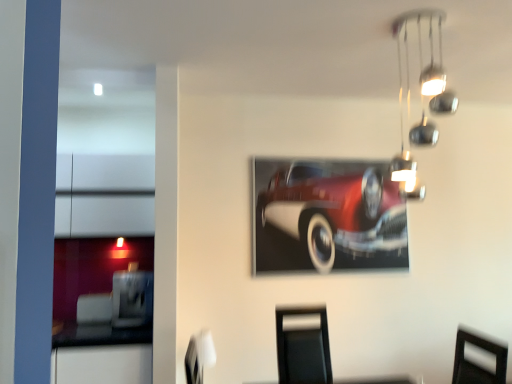
Question: In terms of size, does white fabric swivel chair at lower center appear bigger or smaller than shiny red car at center?

Choices:
 (A) big
 (B) small

Answer: (B)

Question: From the image's perspective, is white fabric swivel chair at lower center located above or below shiny red car at center?

Choices:
 (A) below
 (B) above

Answer: (A)

Question: Which is farther from the shiny red car at center?

Choices:
 (A) chrome metallic light fixture at upper right
 (B) white fabric swivel chair at lower center

Answer: (B)

Question: Which object is the farthest from the chrome metallic light fixture at upper right?

Choices:
 (A) white fabric swivel chair at lower center
 (B) shiny red car at center

Answer: (A)